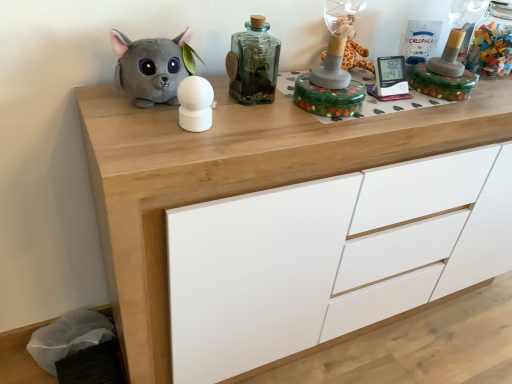
The image size is (512, 384). Find the location of `free space to the right of gray plush toy at left, the third toy in the right-to-left sequence`. free space to the right of gray plush toy at left, the third toy in the right-to-left sequence is located at coordinates (247, 119).